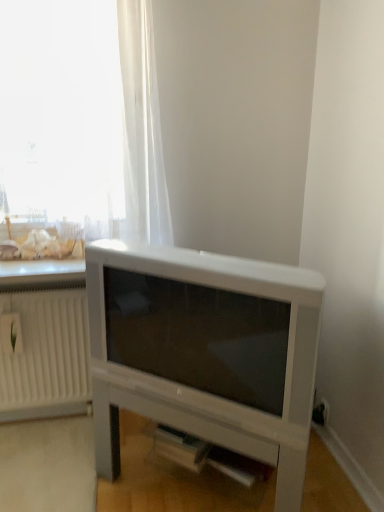
You are a GUI agent. You are given a task and a screenshot of the screen. Output one action in this format:
    pyautogui.click(x=<x>, y=<y>)
    Task: Click on the vacant area situated below white plastic radiator at left (from a real-world perspective)
    
    Given the screenshot: What is the action you would take?
    pyautogui.click(x=47, y=417)